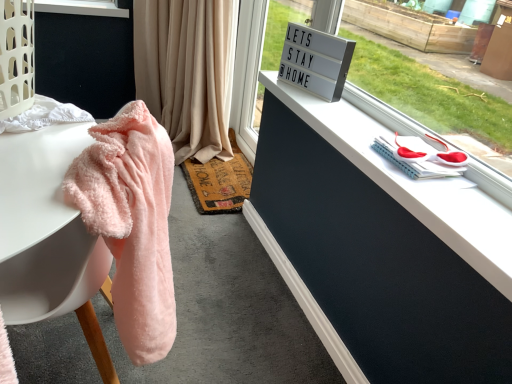
Question: From a real-world perspective, relative to white matte dresser at upper right, is rustic woven mat at center vertically above or below?

Choices:
 (A) above
 (B) below

Answer: (B)

Question: Is rustic woven mat at center spatially inside white matte dresser at upper right, or outside of it?

Choices:
 (A) outside
 (B) inside

Answer: (A)

Question: Estimate the real-world distances between objects in this image. Which object is farther from the white matte dresser at upper right?

Choices:
 (A) fluffy pink towel at left
 (B) fluffy pink towel at left
 (C) white plastic sign at upper center
 (D) beige fabric curtain at upper center
 (E) rustic woven mat at center

Answer: (C)

Question: Estimate the real-world distances between objects in this image. Which object is closer to the beige fabric curtain at upper center?

Choices:
 (A) rustic woven mat at center
 (B) fluffy pink towel at left
 (C) fluffy pink towel at left
 (D) white plastic sign at upper center
 (E) white matte dresser at upper right

Answer: (D)